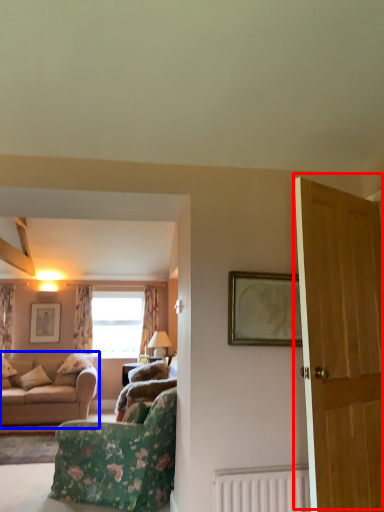
Question: Which object appears farthest to the camera in this image, door (highlighted by a red box) or studio couch (highlighted by a blue box)?

Choices:
 (A) door
 (B) studio couch

Answer: (B)